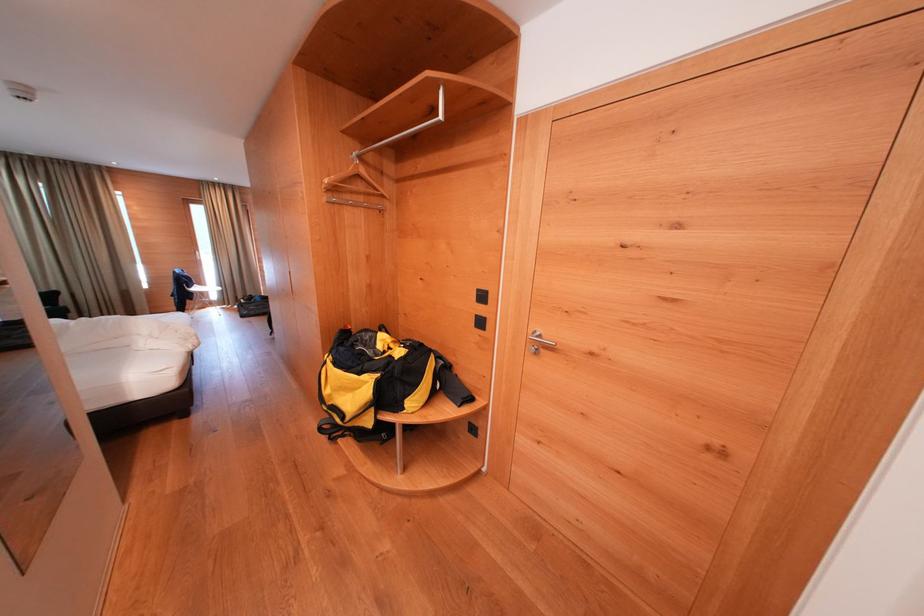
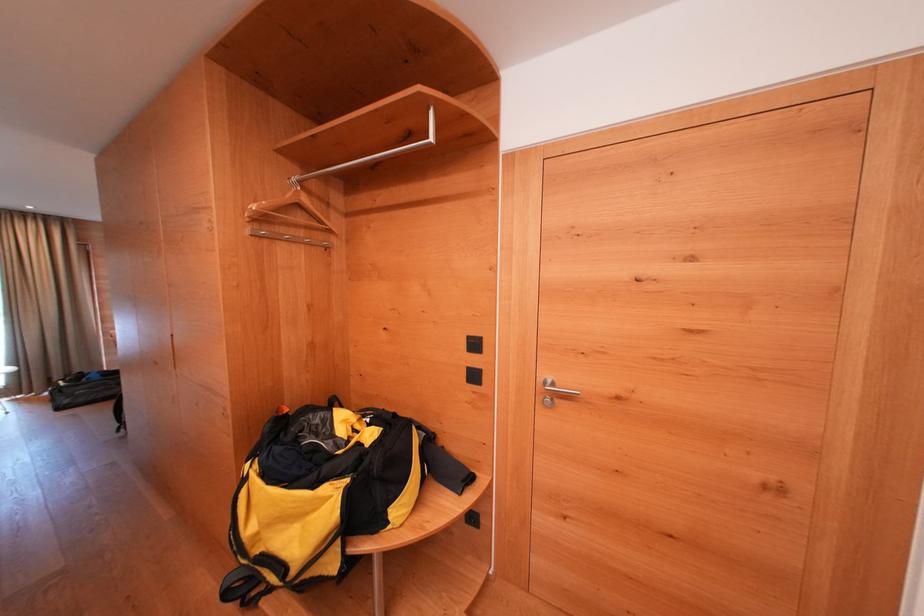
Locate, in the second image, the point that corresponds to point 488,326 in the first image.

(481, 381)